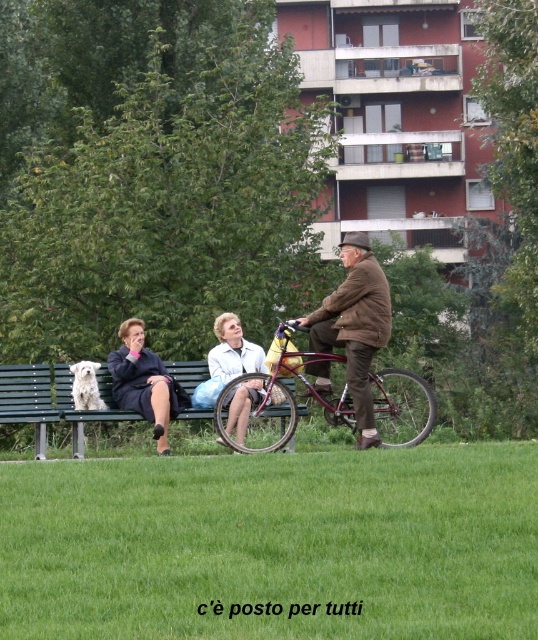
Question: Which object is the farthest from the green wooden bench at left?

Choices:
 (A) brown leather jacket at center
 (B) green grass at lower center

Answer: (B)

Question: Can you confirm if green grass at lower center is positioned below white fluffy dog at left?

Choices:
 (A) yes
 (B) no

Answer: (A)

Question: Which of the following is the farthest from the observer?

Choices:
 (A) (364, 269)
 (B) (93, 416)
 (C) (235, 416)

Answer: (B)

Question: Can you confirm if green wooden bench at left is positioned to the left of light blue fabric dress at center?

Choices:
 (A) yes
 (B) no

Answer: (A)

Question: Can you confirm if brown leather jacket at center is wider than dark blue fabric coat at center?

Choices:
 (A) no
 (B) yes

Answer: (A)

Question: Which object appears farthest from the camera in this image?

Choices:
 (A) white fluffy dog at left
 (B) green wooden bench at left
 (C) green grass at lower center

Answer: (A)